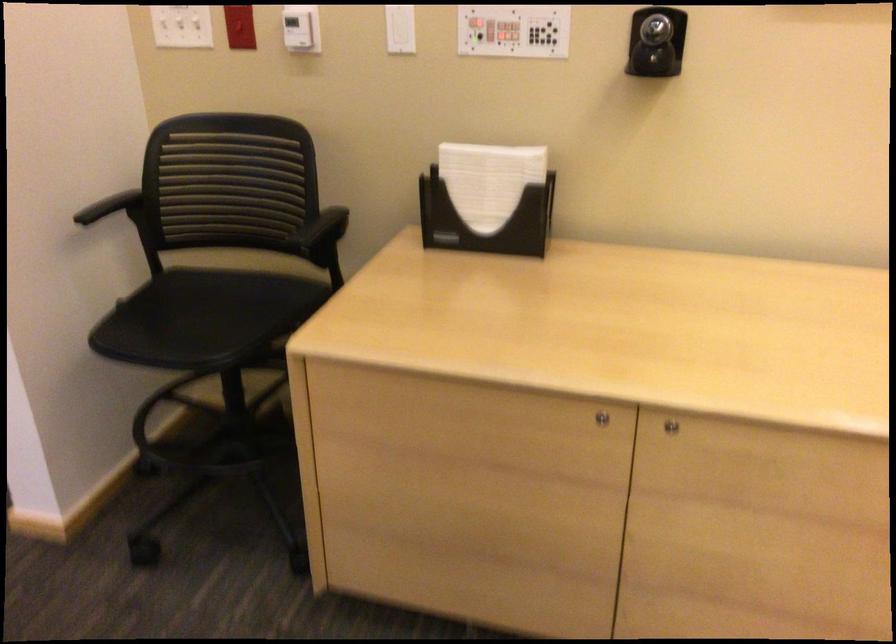
Where would you sit the chair sitting surface? Please return your answer as a coordinate pair (x, y).

(204, 317)